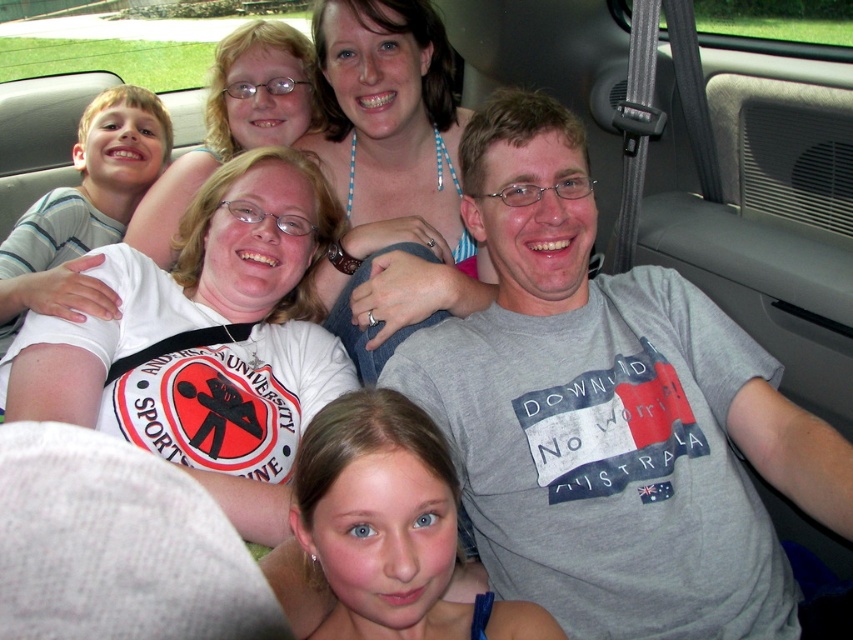
Between gray cotton t-shirt at center and striped cotton shirt at left, which one appears on the right side from the viewer's perspective?

gray cotton t-shirt at center

The image size is (853, 640). Identify the location of gray cotton t-shirt at center. (610, 413).

Locate an element on the screen. gray cotton t-shirt at center is located at coordinates (610, 413).

Between gray cotton t-shirt at center and blue beaded necklace at upper center, which one is positioned higher?

Positioned higher is blue beaded necklace at upper center.

Is gray cotton t-shirt at center above blue beaded necklace at upper center?

Incorrect, gray cotton t-shirt at center is not positioned above blue beaded necklace at upper center.

Does point (547, 564) come in front of point (389, 339)?

Yes.

In order to click on gray cotton t-shirt at center in this screenshot , I will do 610,413.

Is point (439, 35) positioned in front of point (90, 221)?

Yes, point (439, 35) is in front of point (90, 221).

Does blue beaded necklace at upper center have a larger size compared to striped cotton shirt at left?

Incorrect, blue beaded necklace at upper center is not larger than striped cotton shirt at left.

Is point (473, 308) positioned before point (125, 141)?

Yes, point (473, 308) is closer to viewer.

Find the location of a particular element. Image resolution: width=853 pixels, height=640 pixels. blue beaded necklace at upper center is located at coordinates pyautogui.click(x=390, y=173).